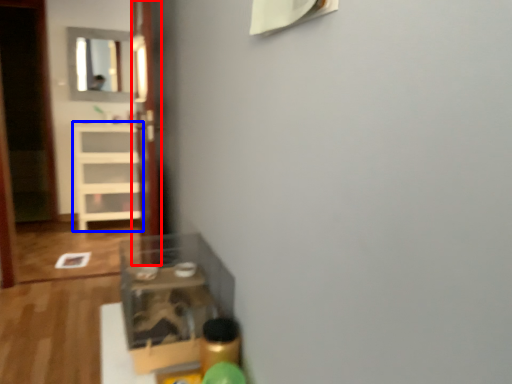
Question: Which object is further to the camera taking this photo, glass door (highlighted by a red box) or shelf (highlighted by a blue box)?

Choices:
 (A) glass door
 (B) shelf

Answer: (B)